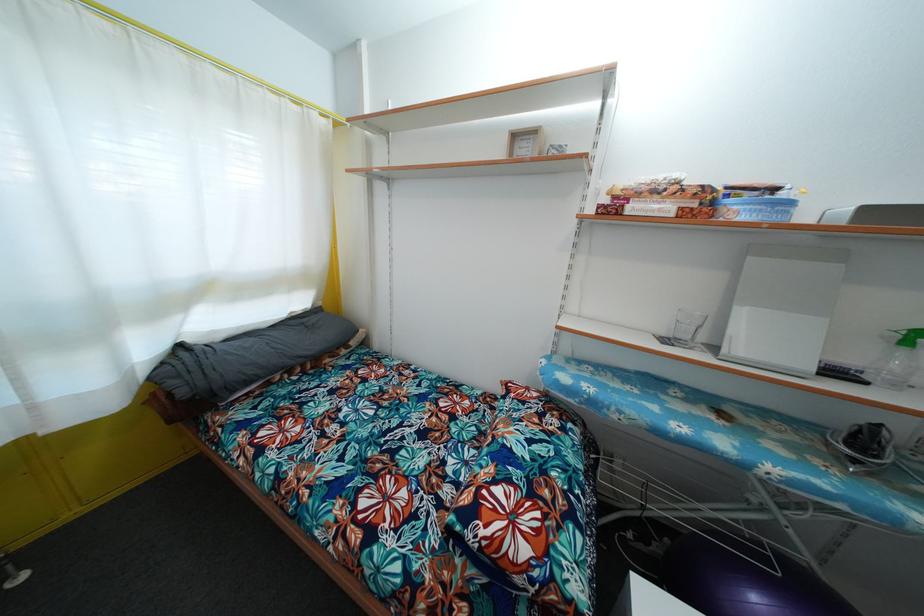
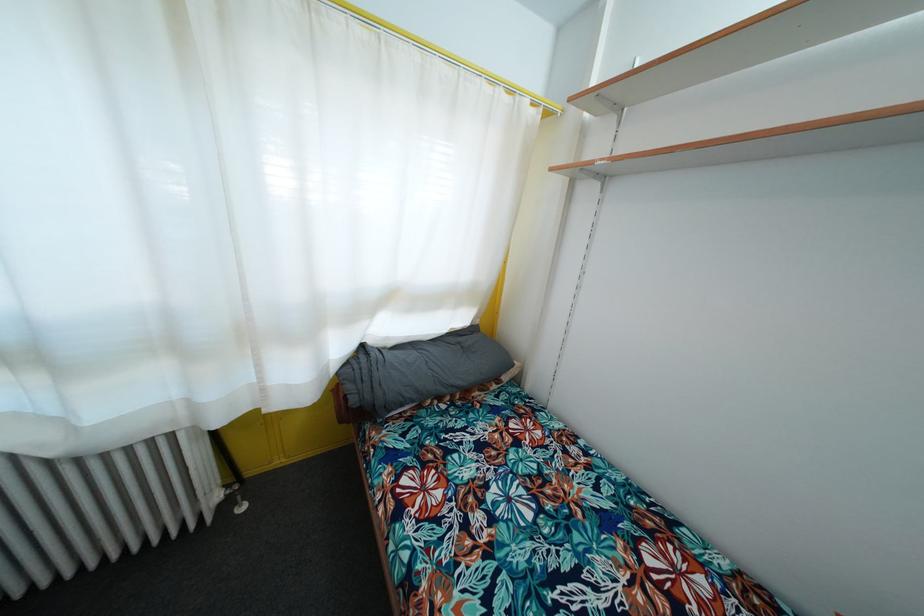
Question: Based on the continuous images, in which direction is the camera rotating? Reply with the corresponding letter.

Choices:
 (A) Left
 (B) Right
 (C) Up
 (D) Down

Answer: (A)